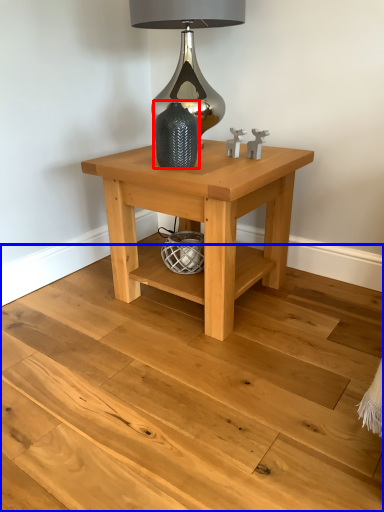
Question: Which object appears farthest to the camera in this image, vase (highlighted by a red box) or stair (highlighted by a blue box)?

Choices:
 (A) vase
 (B) stair

Answer: (A)